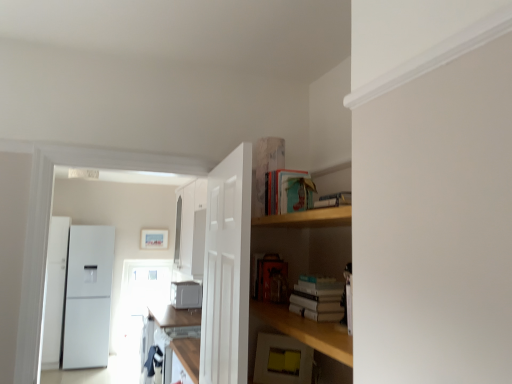
Question: Would you say white matte book at center, which is counted as the 2th book, starting from the top, is part of teal matte book at upper center, which ranks as the second book in bottom-to-top order,'s contents?

Choices:
 (A) no
 (B) yes

Answer: (A)

Question: From a real-world perspective, is teal matte book at upper center, the 1th book viewed from the top, beneath white matte book at center, arranged as the 1th book when ordered from the bottom?

Choices:
 (A) no
 (B) yes

Answer: (A)

Question: Is teal matte book at upper center, which ranks as the second book in bottom-to-top order, directly adjacent to white matte book at center, arranged as the 1th book when ordered from the bottom?

Choices:
 (A) no
 (B) yes

Answer: (A)

Question: Can you confirm if teal matte book at upper center, the 1th book viewed from the top, is bigger than white matte book at center, which is counted as the 2th book, starting from the top?

Choices:
 (A) yes
 (B) no

Answer: (B)

Question: Is white matte book at center, which is counted as the 2th book, starting from the top, at the back of teal matte book at upper center, which ranks as the second book in bottom-to-top order?

Choices:
 (A) no
 (B) yes

Answer: (A)

Question: From a real-world perspective, relative to white matte door at center, is white glossy cabinet at upper left, which is counted as the second cabinetry, starting from the bottom, vertically above or below?

Choices:
 (A) above
 (B) below

Answer: (A)

Question: Is white glossy cabinet at upper left, which is the 2th cabinetry in front-to-back order, spatially inside white matte door at center, or outside of it?

Choices:
 (A) outside
 (B) inside

Answer: (A)

Question: From the image's perspective, is white glossy cabinet at upper left, which is counted as the second cabinetry, starting from the bottom, located above or below white matte door at center?

Choices:
 (A) above
 (B) below

Answer: (B)

Question: In terms of width, does white glossy cabinet at upper left, which is the 2th cabinetry in front-to-back order, look wider or thinner when compared to white matte door at center?

Choices:
 (A) wide
 (B) thin

Answer: (A)

Question: In terms of width, does matte wooden picture frame at upper center look wider or thinner when compared to yellow matte sticky notes at lower center, marked as the 1th appliance in a front-to-back arrangement?

Choices:
 (A) thin
 (B) wide

Answer: (A)

Question: Considering the positions of matte wooden picture frame at upper center and yellow matte sticky notes at lower center, arranged as the first appliance when viewed from the right, in the image, is matte wooden picture frame at upper center taller or shorter than yellow matte sticky notes at lower center, arranged as the first appliance when viewed from the right,?

Choices:
 (A) short
 (B) tall

Answer: (B)

Question: Relative to yellow matte sticky notes at lower center, the second appliance from the back, is matte wooden picture frame at upper center in front or behind?

Choices:
 (A) behind
 (B) front

Answer: (A)

Question: Does point (159, 235) appear closer or farther from the camera than point (276, 360)?

Choices:
 (A) closer
 (B) farther

Answer: (B)

Question: Looking at their shapes, would you say white matte book at center, arranged as the 1th book when ordered from the bottom, is wider or thinner than teal matte book at upper center, the 1th book viewed from the top?

Choices:
 (A) wide
 (B) thin

Answer: (A)

Question: Visually, is white matte book at center, which is counted as the 2th book, starting from the top, positioned to the left or to the right of teal matte book at upper center, the 1th book viewed from the top?

Choices:
 (A) left
 (B) right

Answer: (B)